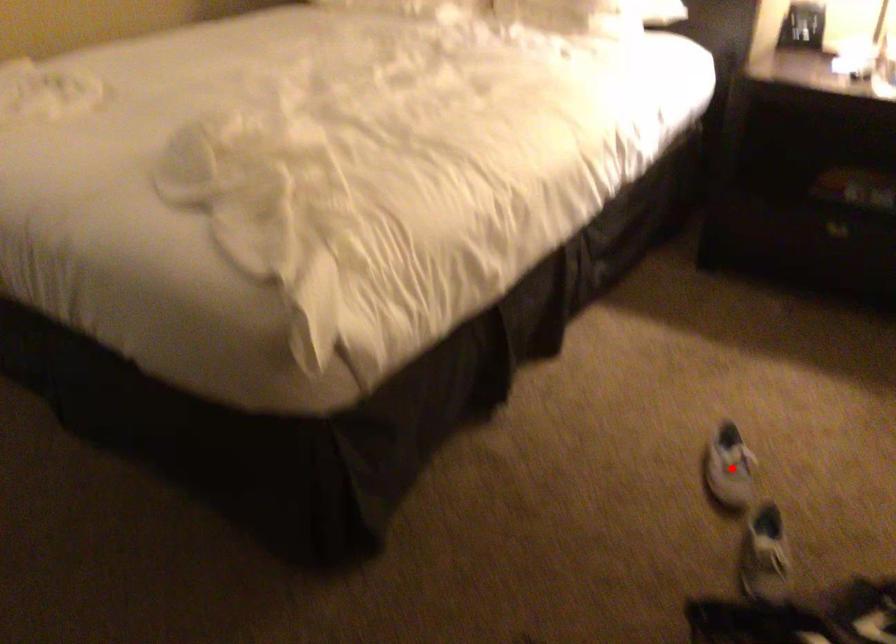
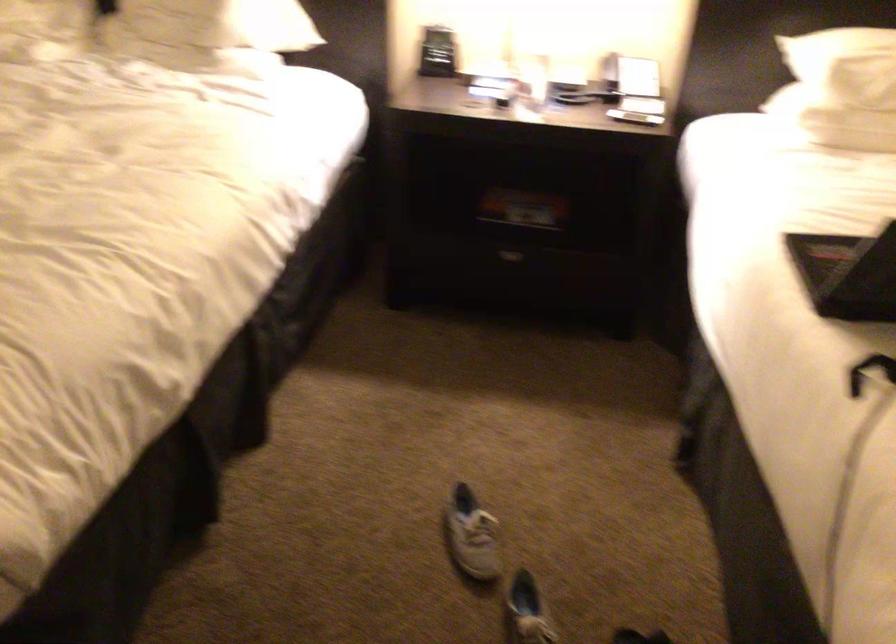
Where in the second image is the point corresponding to the highlighted location from the first image?

(470, 535)